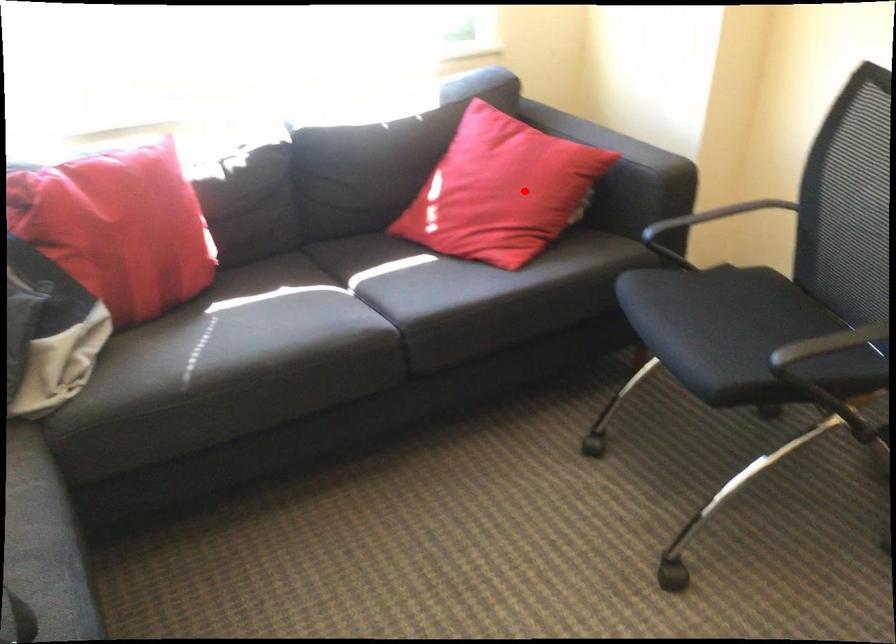
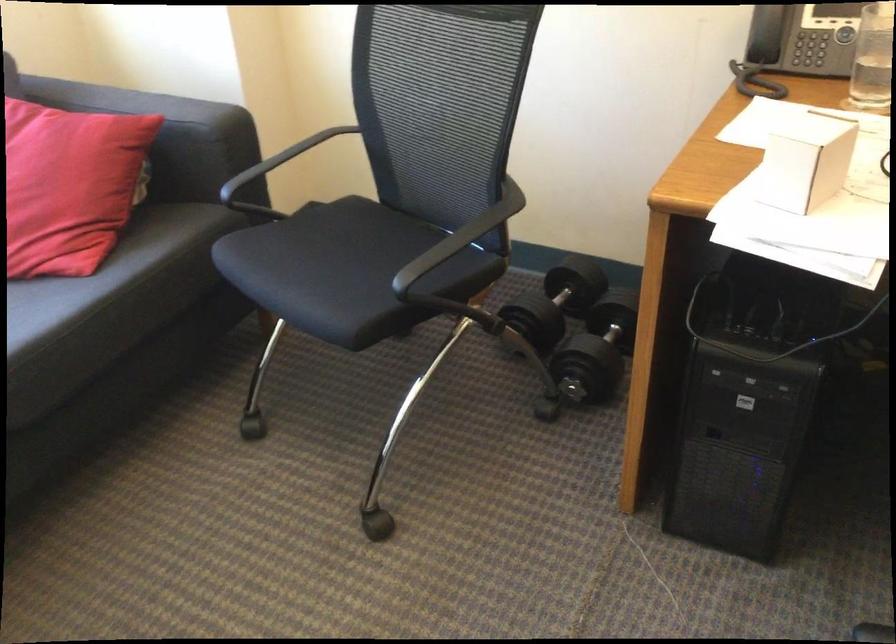
Question: I am providing you with two images of the same scene from different viewpoints. A red point is shown in image1. For the corresponding object point in image2, is it positioned nearer or farther from the camera?

Choices:
 (A) Nearer
 (B) Farther

Answer: (A)